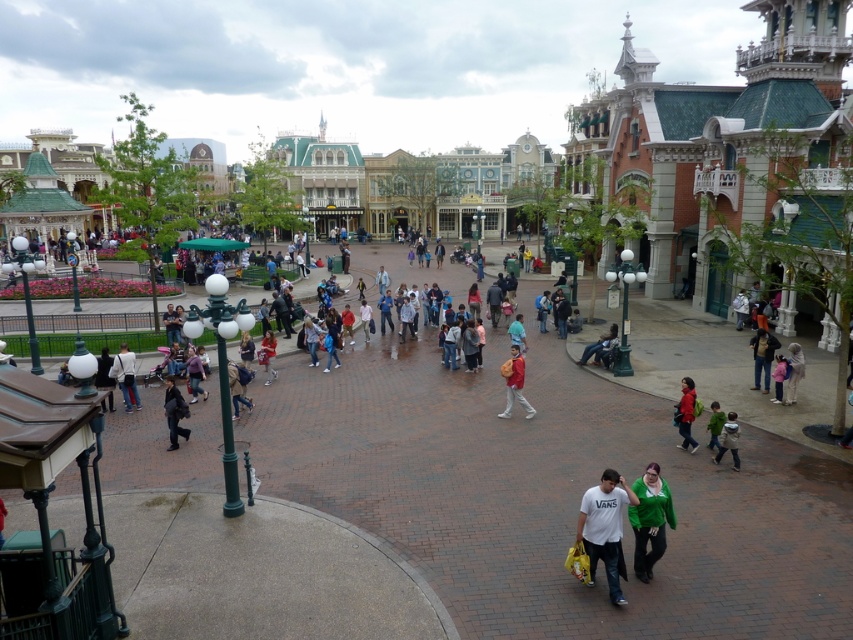
You are standing at the entrance of the theme park and see both the light brown leather jacket at center and the green fabric jacket at lower right. Which jacket is closer to you?

The light brown leather jacket at center is closer to you because it is only 33.13 meters away from the green fabric jacket at lower right, which is farther away.

You are a photographer trying to capture both the light brown leather jacket at center and the green fabric jacket at lower right in a single shot. Which jacket will appear smaller in the photo?

The light brown leather jacket at center will appear smaller in the photo because it is physically smaller than the green fabric jacket at lower right.